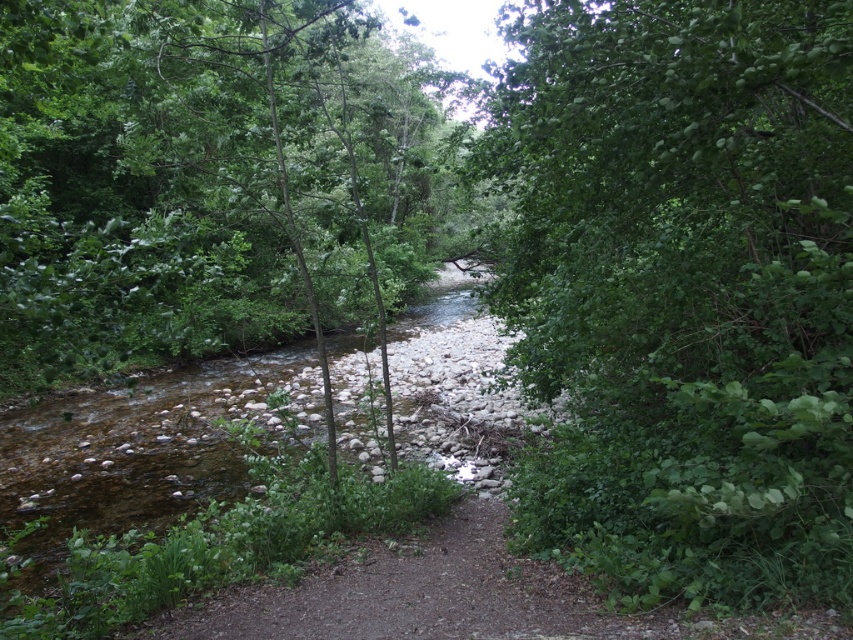
Can you confirm if green leafy tree at right is shorter than green leafy tree at center?

Yes, green leafy tree at right is shorter than green leafy tree at center.

Which is behind, point (706, 298) or point (265, 76)?

Positioned behind is point (265, 76).

Locate an element on the screen. The height and width of the screenshot is (640, 853). green leafy tree at right is located at coordinates (683, 289).